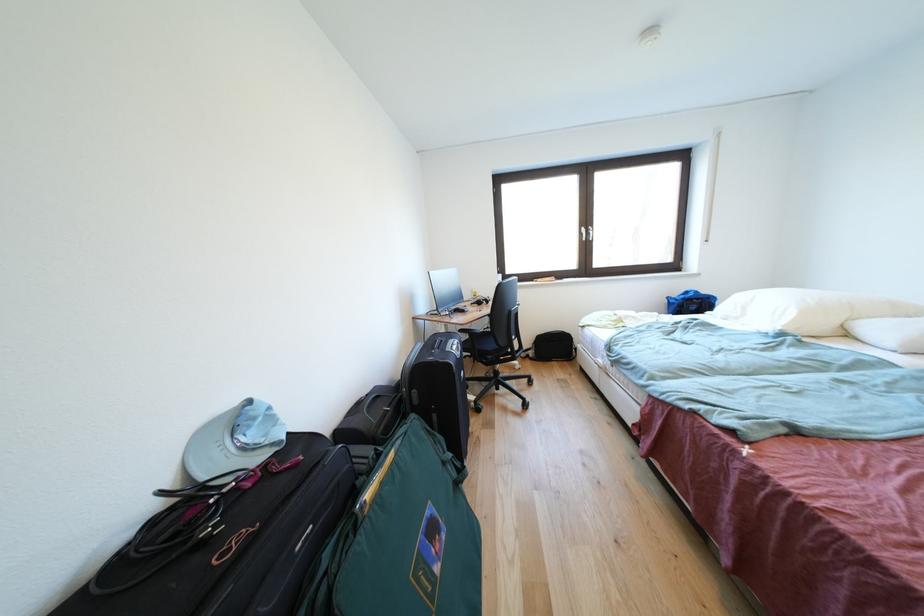
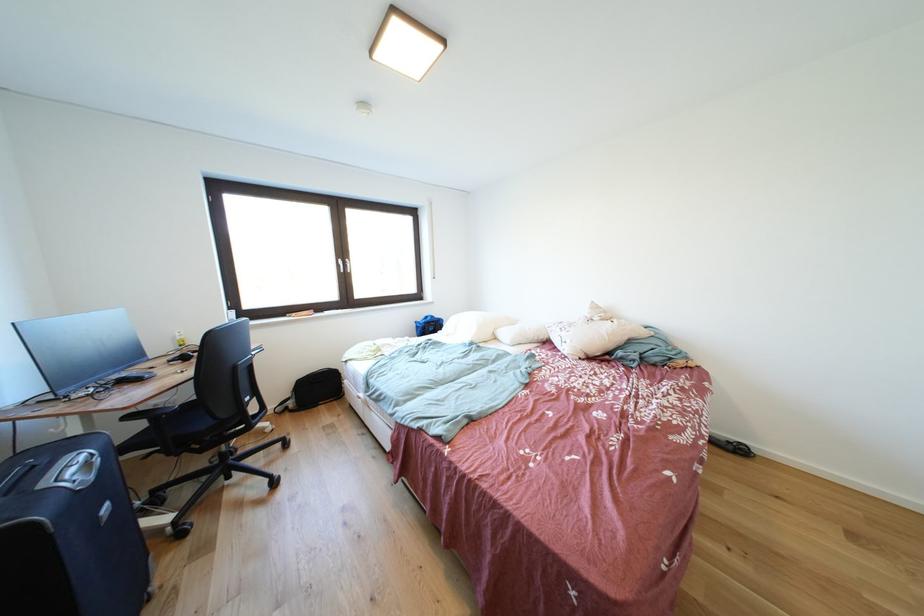
The point at (713, 297) is marked in the first image. Where is the corresponding point in the second image?

(445, 321)